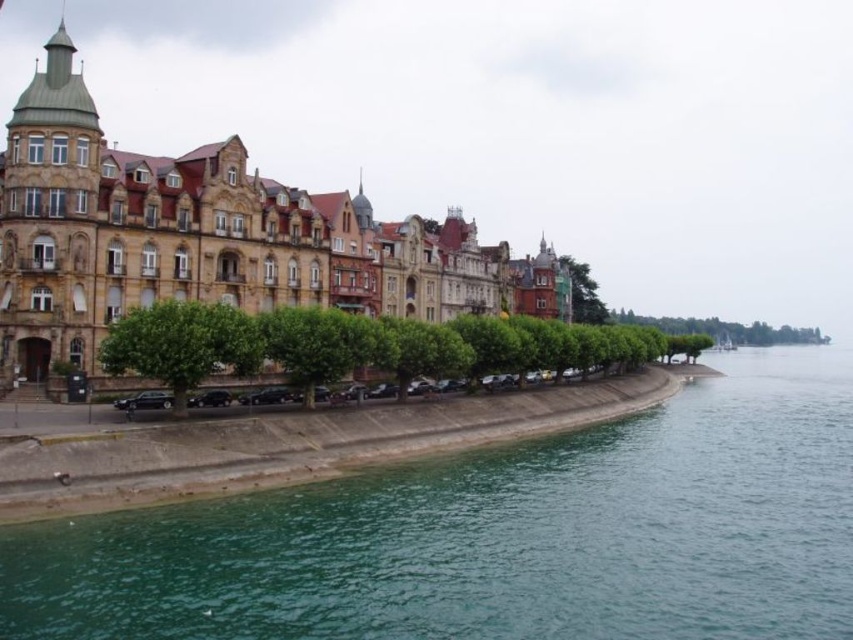
You are standing at the point labeled point [241,604] and want to walk towards the point labeled point [602,333]. According to the scene description, which direction should you turn to face the buildings?

You should turn to face the buildings behind you because point [241,604] is in front of point [602,333], meaning the buildings are located behind your current position.

You are standing at the point marked as point (498, 536) in the waterfront scene. Looking around, you see the row of ornate buildings and the green trees along the walkway. Which direction should you walk to reach the green water at lower left?

The green water at lower left is located exactly at point (498, 536), so you are already standing on the green water at lower left.